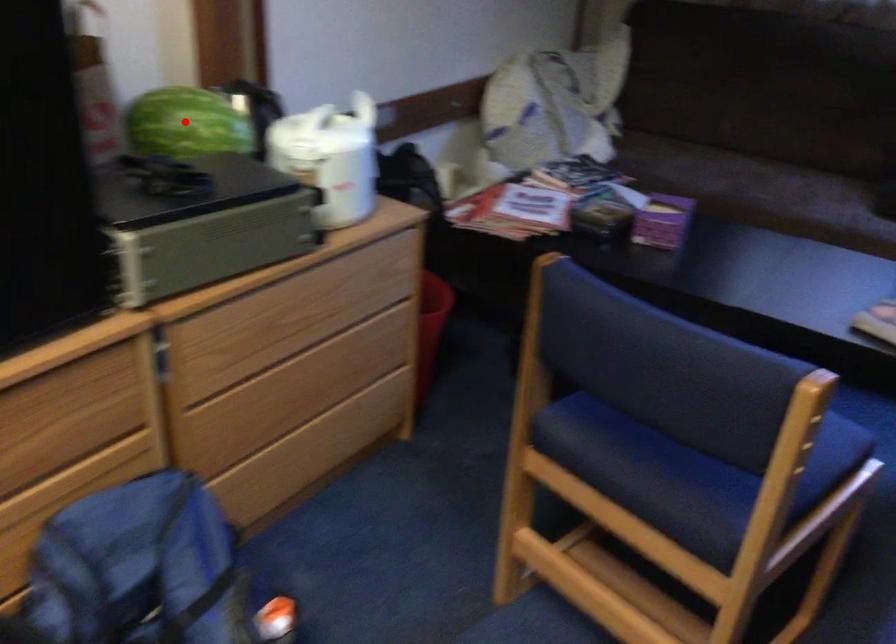
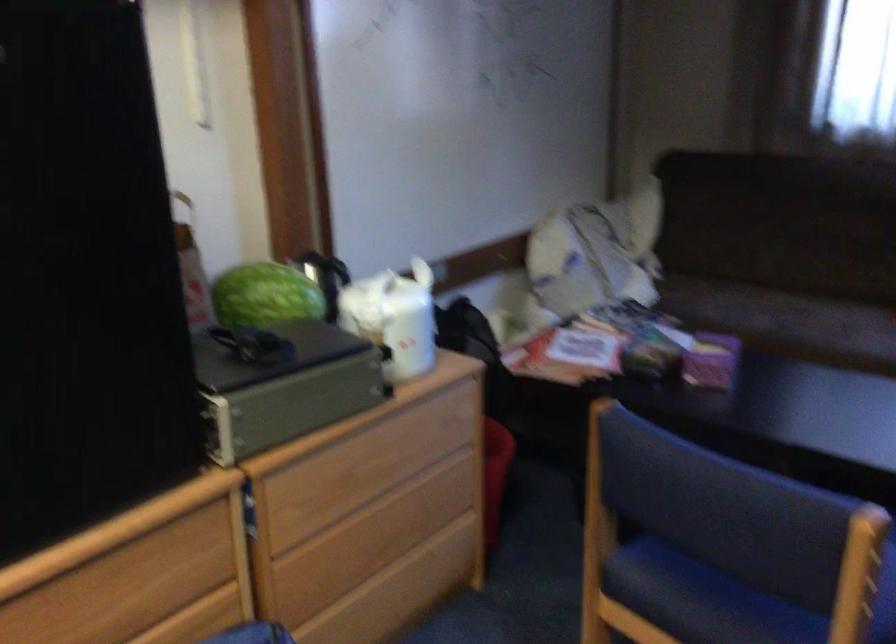
Find the pixel in the second image that matches the highlighted location in the first image.

(264, 295)